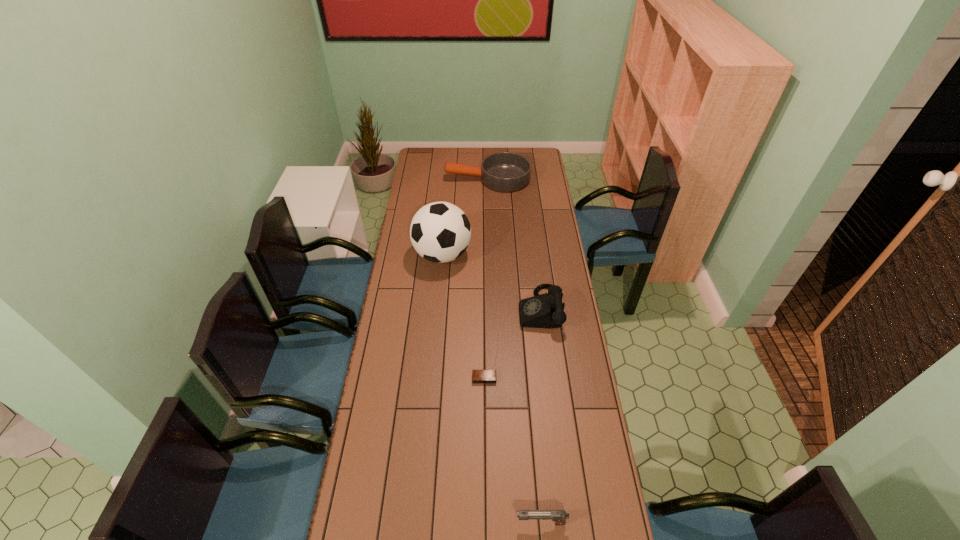
The image size is (960, 540). What are the coordinates of `vacant area that lies between the farthest object and the nearest object` in the screenshot? It's located at (515, 350).

In order to click on free point between the tallest object and the gun in this screenshot , I will do `click(492, 389)`.

Locate an element on the screen. vacant space in between the farthest object and the nearest object is located at coordinates (515, 350).

Identify the location of free spot between the fourth nearest object and the second nearest object. (464, 316).

This screenshot has width=960, height=540. I want to click on free spot between the third nearest object and the soccer ball, so click(491, 282).

The height and width of the screenshot is (540, 960). Find the location of `free space between the shortest object and the farthest object`. free space between the shortest object and the farthest object is located at coordinates (486, 279).

At what (x,y) coordinates should I click in order to perform the action: click on vacant area between the pan and the nearest object. Please return your answer as a coordinate pair (x, y). The height and width of the screenshot is (540, 960). Looking at the image, I should click on (515, 350).

Identify which object is the closest to the second tallest object. Please provide its 2D coordinates. Your answer should be formatted as a tuple, i.e. [(x, y)], where the tuple contains the x and y coordinates of a point satisfying the conditions above.

[(478, 376)]

Identify the location of object that is the closest one to the alarm clock. The height and width of the screenshot is (540, 960). (546, 310).

This screenshot has width=960, height=540. I want to click on vacant point that satisfies the following two spatial constraints: 1. on the handle side of the pan; 2. on the front side of the tallest object, so click(490, 255).